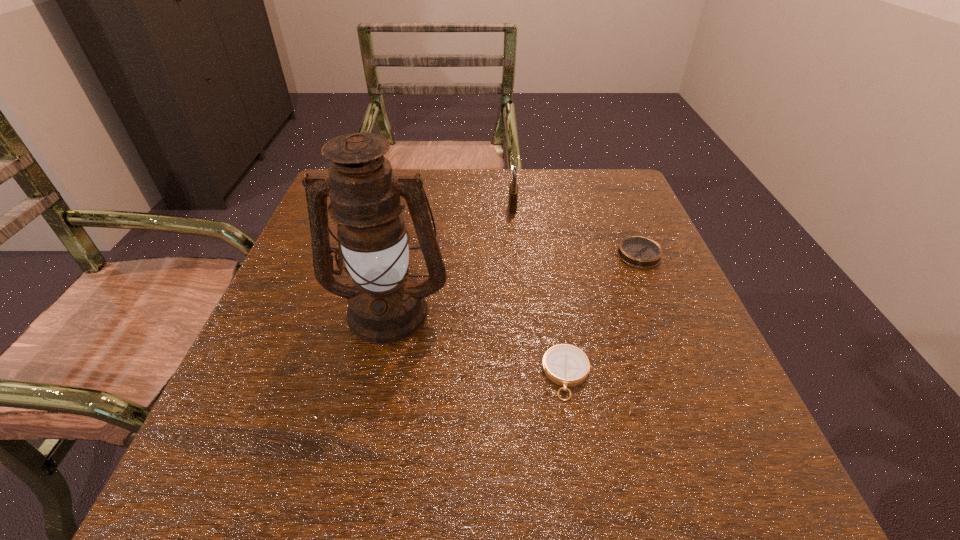
At what (x,y) coordinates should I click in order to perform the action: click on free point between the right compass and the oil lamp. Please return your answer as a coordinate pair (x, y). This screenshot has width=960, height=540. Looking at the image, I should click on (514, 282).

At what (x,y) coordinates should I click in order to perform the action: click on free space between the oil lamp and the third object from left to right. Please return your answer as a coordinate pair (x, y). The width and height of the screenshot is (960, 540). Looking at the image, I should click on (478, 342).

Image resolution: width=960 pixels, height=540 pixels. Identify the location of free space between the second object from right to left and the rightmost object. (603, 314).

This screenshot has height=540, width=960. I want to click on free spot between the left compass and the rightmost object, so click(603, 314).

Image resolution: width=960 pixels, height=540 pixels. Identify the location of unoccupied position between the third object from right to left and the third nearest object. (576, 231).

This screenshot has width=960, height=540. In order to click on free space between the rightmost object and the nearer compass in this screenshot , I will do `click(603, 314)`.

What are the coordinates of `vacant space that's between the second tallest object and the third object from left to right` in the screenshot? It's located at (540, 291).

Where is `empty space between the third object from left to right and the third object from right to left`? This screenshot has height=540, width=960. empty space between the third object from left to right and the third object from right to left is located at coordinates (540, 291).

This screenshot has height=540, width=960. In order to click on vacant area between the farthest object and the leftmost object in this screenshot , I will do `click(451, 259)`.

The height and width of the screenshot is (540, 960). Identify the location of free space between the rightmost object and the leftmost object. (514, 282).